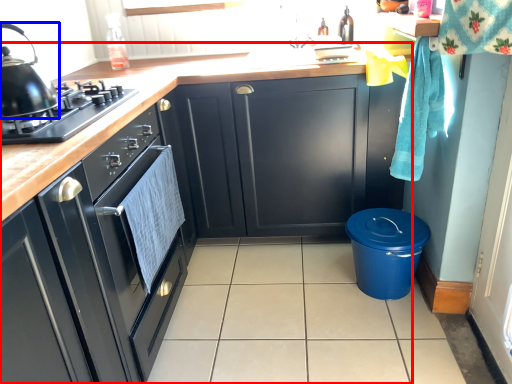
Question: Which point is closer to the camera, cabinetry (highlighted by a red box) or kitchen appliance (highlighted by a blue box)?

Choices:
 (A) cabinetry
 (B) kitchen appliance

Answer: (A)